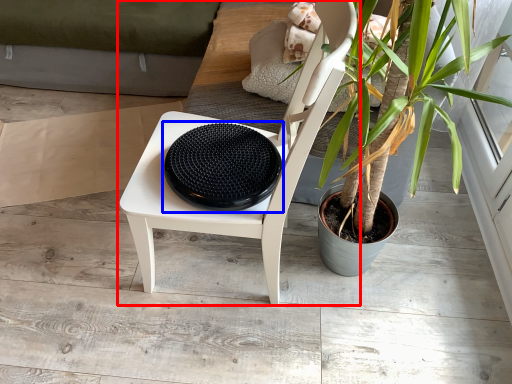
Question: Among these objects, which one is nearest to the camera, chair (highlighted by a red box) or manhole cover (highlighted by a blue box)?

Choices:
 (A) chair
 (B) manhole cover

Answer: (A)